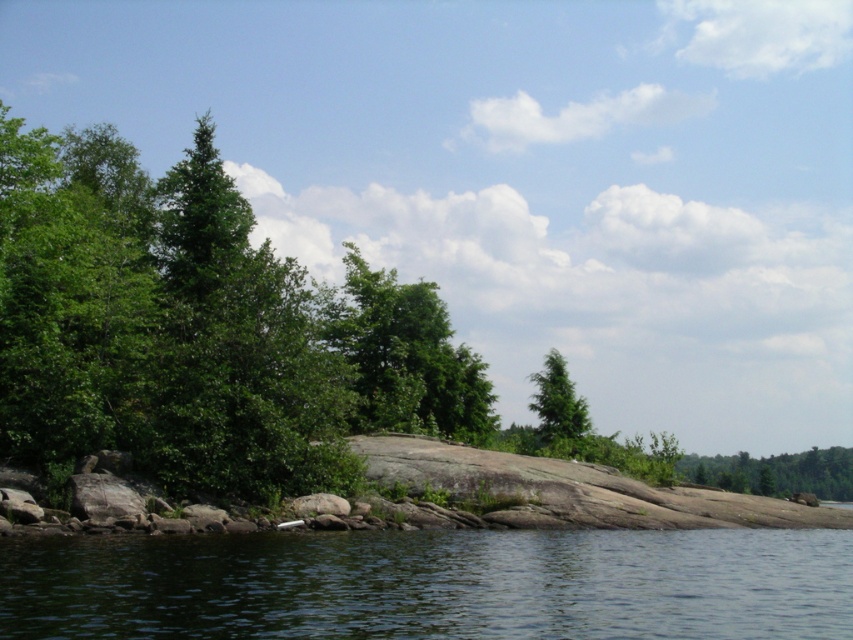
You are standing at the edge of the water and want to place a small flag at each of the two points marked in the image. Which point, point (439, 388) or point (576, 406), is closer to you where you can place the flag more easily?

Point (439, 388) is closer to the viewer than point (576, 406), so you can place the flag there more easily.

From the picture: You are standing on the rocky shoreline and looking towards the dense line of trees in the background. Which tree do you see first, the green leafy tree at center or the green matte tree at upper center?

The green leafy tree at center is positioned on the left side of the green matte tree at upper center, so you would see the green leafy tree at center first as it is closer to your line of sight.